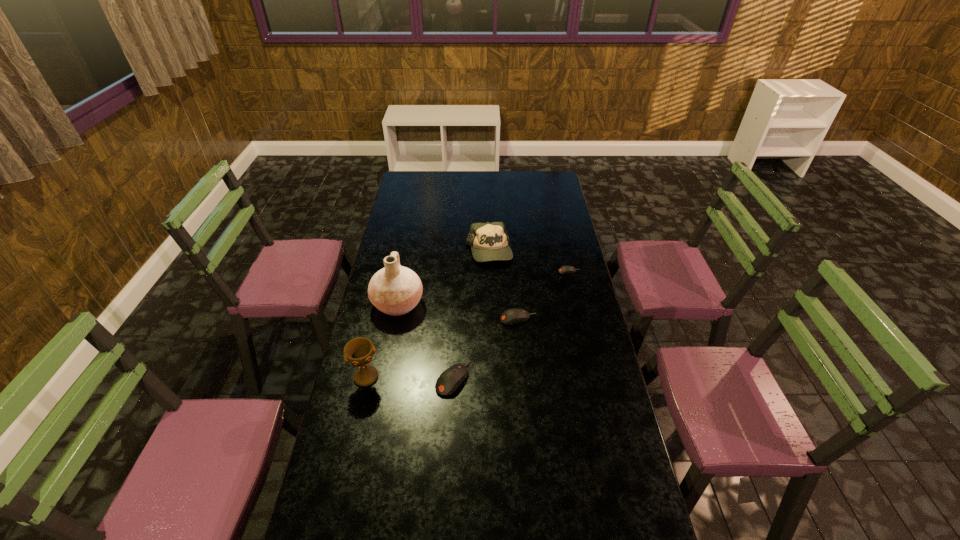
The width and height of the screenshot is (960, 540). I want to click on free point that keeps the computer mouses evenly spaced on the left, so click(368, 457).